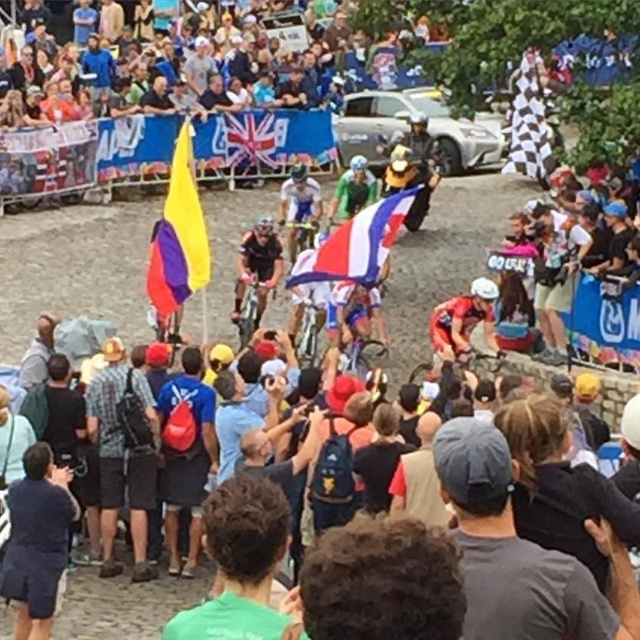
You are a photographer at the cycling race event. You need to capture a photo that includes both the dark brown leather jacket at lower right and the dark blue shorts at lower left. Which object should you focus on first to ensure both are in frame?

You should focus on the dark brown leather jacket at lower right first because it is larger in size than the dark blue shorts at lower left, ensuring it fits within the frame while adjusting for the smaller object.

You are a photographer positioned at the center of the crowd. You notice a cyclist approaching from the middle ground and want to capture a photo of them while also including the dark brown leather jacket at lower right in the frame. Given their positions, can you fit both the cyclist and the jacket into your shot?

The dark brown leather jacket at lower right is located at point (561, 486), so yes, the photographer can position themselves to include both the cyclist in the middle ground and the jacket in the lower right corner of the frame.